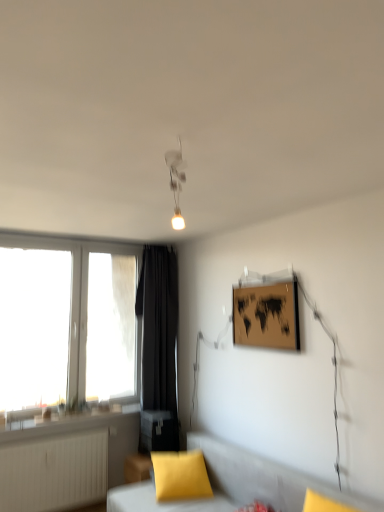
Identify the location of wooden matte picture frame at upper right. (266, 316).

What is the approximate height of soft gray cushion at lower center?

The height of soft gray cushion at lower center is 28.63 inches.

Describe the element at coordinates (158, 348) in the screenshot. I see `black fabric curtain at left` at that location.

This screenshot has width=384, height=512. In order to click on wooden matte picture frame at upper right in this screenshot , I will do `click(266, 316)`.

Between matte white ceiling light at upper center and wooden matte picture frame at upper right, which one has smaller width?

Thinner between the two is wooden matte picture frame at upper right.

Is matte white ceiling light at upper center taller than wooden matte picture frame at upper right?

No.

Which is more to the right, matte white ceiling light at upper center or wooden matte picture frame at upper right?

wooden matte picture frame at upper right.

From a real-world perspective, does wooden matte picture frame at upper right sit lower than black fabric curtain at left?

Incorrect, from a real-world perspective, wooden matte picture frame at upper right is higher than black fabric curtain at left.

From the image's perspective, between wooden matte picture frame at upper right and black fabric curtain at left, which one is located above?

wooden matte picture frame at upper right appears higher in the image.

Who is bigger, wooden matte picture frame at upper right or black fabric curtain at left?

With larger size is black fabric curtain at left.

From the picture: Is wooden matte picture frame at upper right shorter than black fabric curtain at left?

Indeed, wooden matte picture frame at upper right has a lesser height compared to black fabric curtain at left.

Is wooden matte picture frame at upper right to the left of matte yellow pillow at lower center from the viewer's perspective?

Incorrect, wooden matte picture frame at upper right is not on the left side of matte yellow pillow at lower center.

Is wooden matte picture frame at upper right aimed at matte yellow pillow at lower center?

No, wooden matte picture frame at upper right is not oriented towards matte yellow pillow at lower center.

Considering the positions of points (252, 301) and (187, 476), is point (252, 301) farther from camera compared to point (187, 476)?

Yes, point (252, 301) is farther from viewer.

From a real-world perspective, is matte yellow pillow at lower center physically located above or below matte white ceiling light at upper center?

matte yellow pillow at lower center is below matte white ceiling light at upper center.

From the image's perspective, is matte yellow pillow at lower center located above or below matte white ceiling light at upper center?

Based on their image positions, matte yellow pillow at lower center is located beneath matte white ceiling light at upper center.

Is matte yellow pillow at lower center wider than matte white ceiling light at upper center?

Yes.

Is matte white ceiling light at upper center taller or shorter than white plastic window at left?

Clearly, matte white ceiling light at upper center is shorter compared to white plastic window at left.

Where is `window behind the matte white ceiling light at upper center`? The height and width of the screenshot is (512, 384). window behind the matte white ceiling light at upper center is located at coordinates (66, 323).

From the image's perspective, which object appears higher, matte white ceiling light at upper center or white plastic window at left?

matte white ceiling light at upper center, from the image's perspective.

Which of these two, matte white ceiling light at upper center or white plastic window at left, is smaller?

With smaller size is matte white ceiling light at upper center.

Is soft gray cushion at lower center surrounding black fabric curtain at left?

No, black fabric curtain at left is not inside soft gray cushion at lower center.

Is soft gray cushion at lower center facing away from black fabric curtain at left?

No.

Does point (148, 482) come closer to viewer compared to point (171, 417)?

Yes, point (148, 482) is in front of point (171, 417).

Considering the points (183, 223) and (329, 490), which point is in front, point (183, 223) or point (329, 490)?

Positioned in front is point (329, 490).

Can you tell me how much matte white ceiling light at upper center and soft gray cushion at lower center differ in facing direction?

6.11 degrees.

Is matte white ceiling light at upper center taller than soft gray cushion at lower center?

A: No, matte white ceiling light at upper center is not taller than soft gray cushion at lower center.

Considering the relative positions of matte white ceiling light at upper center and soft gray cushion at lower center in the image provided, is matte white ceiling light at upper center to the left of soft gray cushion at lower center from the viewer's perspective?

Indeed, matte white ceiling light at upper center is positioned on the left side of soft gray cushion at lower center.

Identify the location of picture frame that is under the matte white ceiling light at upper center (from a real-world perspective). (266, 316).

You are a GUI agent. You are given a task and a screenshot of the screen. Output one action in this format:
    pyautogui.click(x=<x>, y=<y>)
    Task: Click on the picture frame above the black fabric curtain at left (from the image's perspective)
    Image resolution: width=384 pixels, height=512 pixels.
    Given the screenshot: What is the action you would take?
    pyautogui.click(x=266, y=316)

Based on their spatial positions, is black fabric curtain at left or matte yellow pillow at lower center further from white plastic window at left?

matte yellow pillow at lower center is further to white plastic window at left.

Which object lies nearer to the anchor point black fabric curtain at left, matte yellow pillow at lower center or matte white ceiling light at upper center?

matte yellow pillow at lower center lies closer to black fabric curtain at left than the other object.

Which object lies further to the anchor point wooden matte picture frame at upper right, soft gray cushion at lower center or white plastic window at left?

white plastic window at left is positioned further to the anchor wooden matte picture frame at upper right.

Based on their spatial positions, is soft gray cushion at lower center or matte white ceiling light at upper center closer to wooden matte picture frame at upper right?

The object closer to wooden matte picture frame at upper right is soft gray cushion at lower center.

From the image, which object appears to be nearer to soft gray cushion at lower center, black fabric curtain at left or matte yellow pillow at lower center?

Based on the image, matte yellow pillow at lower center appears to be nearer to soft gray cushion at lower center.

From the image, which object appears to be farther from matte yellow pillow at lower center, soft gray cushion at lower center or black fabric curtain at left?

black fabric curtain at left lies further to matte yellow pillow at lower center than the other object.

Based on their spatial positions, is soft gray cushion at lower center or white plastic window at left further from matte white ceiling light at upper center?

Among the two, soft gray cushion at lower center is located further to matte white ceiling light at upper center.

Looking at the image, which one is located further to white plastic window at left, matte white ceiling light at upper center or wooden matte picture frame at upper right?

matte white ceiling light at upper center is positioned further to the anchor white plastic window at left.

Identify the location of picture frame between soft gray cushion at lower center and white plastic window at left in the front-back direction. (266, 316).

Identify the location of picture frame between soft gray cushion at lower center and black fabric curtain at left from front to back. The image size is (384, 512). (266, 316).

Image resolution: width=384 pixels, height=512 pixels. Find the location of `picture frame between matte white ceiling light at upper center and white plastic window at left in the front-back direction`. picture frame between matte white ceiling light at upper center and white plastic window at left in the front-back direction is located at coordinates (266, 316).

Locate an element on the screen. This screenshot has width=384, height=512. pillow between soft gray cushion at lower center and white plastic window at left from front to back is located at coordinates (180, 476).